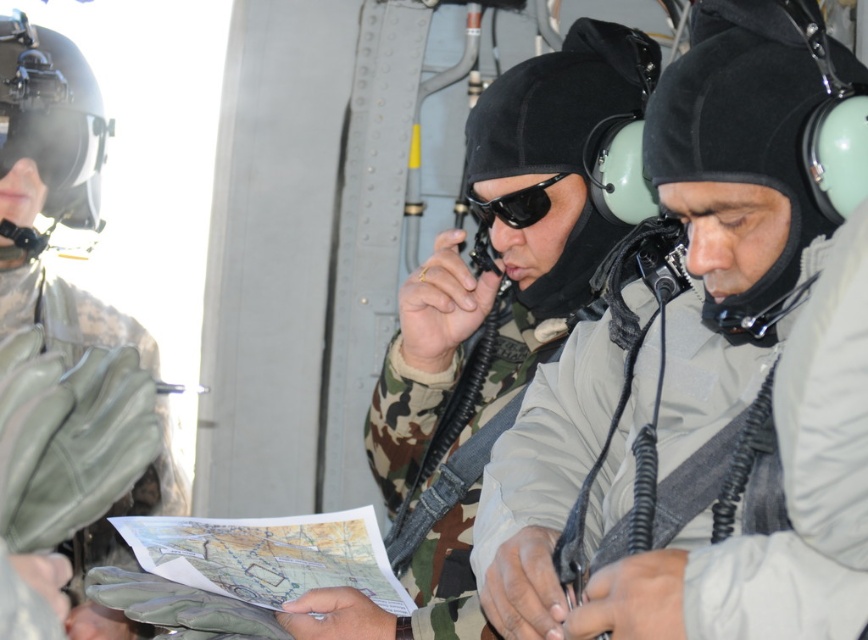
Question: Which point is farther from the camera taking this photo?

Choices:
 (A) (513, 189)
 (B) (615, 240)

Answer: (B)

Question: From the image, what is the correct spatial relationship of camo fabric uniform at center in relation to black matte sunglasses at center?

Choices:
 (A) below
 (B) above

Answer: (A)

Question: Is camo fabric uniform at center to the left of black matte sunglasses at center from the viewer's perspective?

Choices:
 (A) no
 (B) yes

Answer: (B)

Question: Is camo fabric uniform at center thinner than black matte sunglasses at center?

Choices:
 (A) no
 (B) yes

Answer: (A)